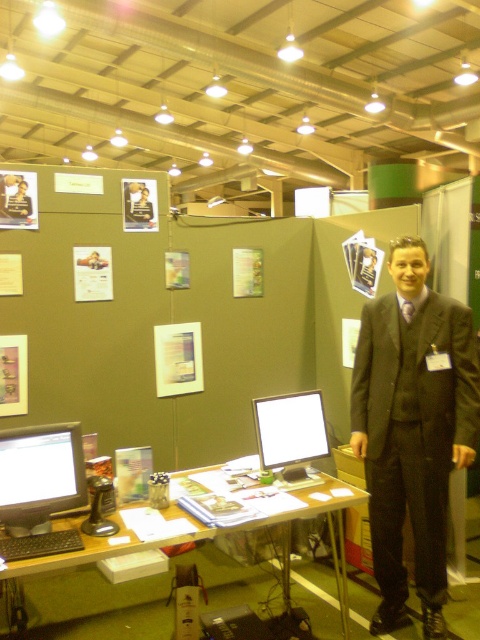
From the picture: Can you confirm if dark gray suit at center is bigger than matte black monitor at left?

Indeed, dark gray suit at center has a larger size compared to matte black monitor at left.

Is dark gray suit at center in front of matte black monitor at left?

No, it is behind matte black monitor at left.

Locate an element on the screen. The width and height of the screenshot is (480, 640). dark gray suit at center is located at coordinates (412, 429).

Can you confirm if matte white monitor at center is bigger than wooden desk at center?

Correct, matte white monitor at center is larger in size than wooden desk at center.

Between matte white monitor at center and wooden desk at center, which one has less height?

wooden desk at center

Between point (303, 445) and point (92, 552), which one is positioned in front?

Point (92, 552) is more forward.

This screenshot has width=480, height=640. In order to click on matte white monitor at center in this screenshot , I will do `click(290, 433)`.

Can you confirm if dark gray suit at center is thinner than wooden desk at center?

Correct, dark gray suit at center's width is less than wooden desk at center's.

Image resolution: width=480 pixels, height=640 pixels. Describe the element at coordinates (412, 429) in the screenshot. I see `dark gray suit at center` at that location.

This screenshot has height=640, width=480. What do you see at coordinates (412, 429) in the screenshot?
I see `dark gray suit at center` at bounding box center [412, 429].

This screenshot has height=640, width=480. What are the coordinates of `dark gray suit at center` in the screenshot? It's located at (412, 429).